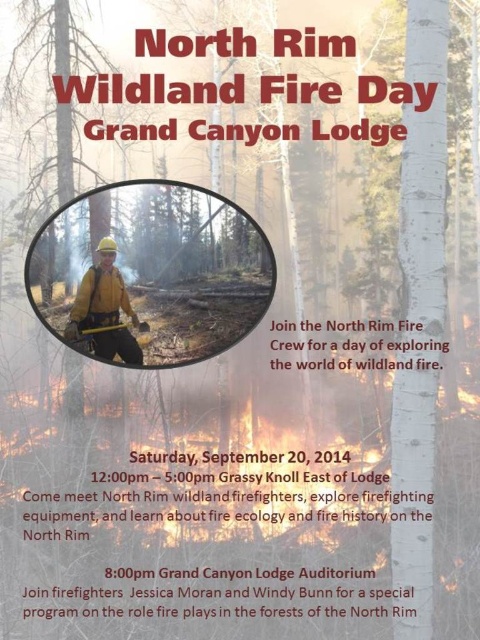
You are designing a poster for an event and need to place a new element to the right of the smooth bark tree at center. Given the coordinates provided, where should you position this new element?

The smooth bark tree at center is located at coordinates point (x=44, y=100). To place the new element to the right of it, you should position it at a higher x coordinate than 0.158 while keeping the y coordinate around 0.092.

You are designing a poster and want to ensure the smooth bark tree at center and the matte yellow helmet at center are spaced correctly. According to the design guidelines, they must be at least 12 inches apart. Is the current spacing compliant?

The smooth bark tree at center and the matte yellow helmet at center are 11.53 inches apart, which is less than the required 12 inches. Therefore, the current spacing is not compliant with the design guidelines.